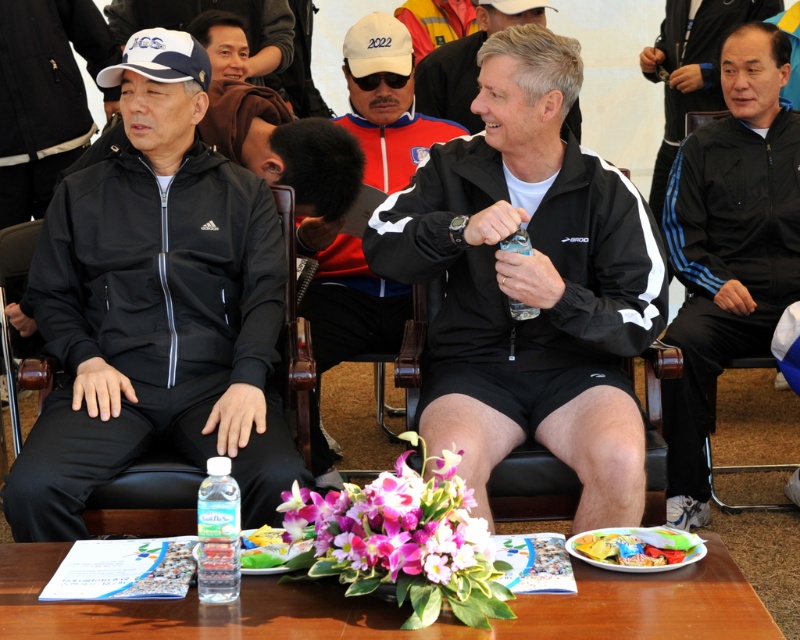
Can you confirm if black matte jacket at left is taller than purple silk orchid at center?

Indeed, black matte jacket at left has a greater height compared to purple silk orchid at center.

Can you confirm if black matte jacket at left is wider than purple silk orchid at center?

Indeed, black matte jacket at left has a greater width compared to purple silk orchid at center.

Between point (274, 461) and point (480, 552), which one is positioned in front?

Point (480, 552) is more forward.

The width and height of the screenshot is (800, 640). In order to click on black matte jacket at left in this screenshot , I will do `click(156, 307)`.

Between black matte jacket at center and purple silk orchid at center, which one appears on the right side from the viewer's perspective?

From the viewer's perspective, black matte jacket at center appears more on the right side.

Does point (514, 93) come in front of point (334, 536)?

No, (514, 93) is further to viewer.

Identify the location of black matte jacket at center. (530, 284).

Is red jacket at center positioned before black matte jacket at upper right?

Yes, it is in front of black matte jacket at upper right.

Who is more distant from viewer, (300, 248) or (654, 202)?

Positioned behind is point (654, 202).

Locate an element on the screen. This screenshot has width=800, height=640. red jacket at center is located at coordinates (386, 102).